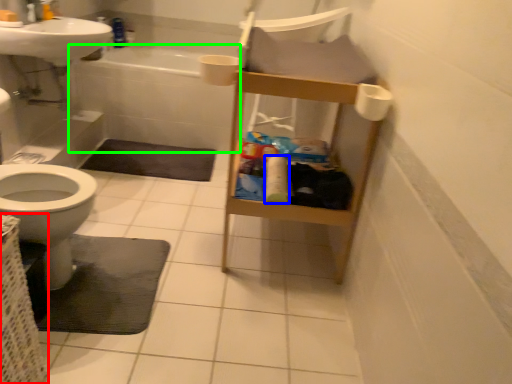
Question: Which object is the farthest from basket (highlighted by a red box)? Choose among these: toilet paper (highlighted by a blue box) or bath (highlighted by a green box).

Choices:
 (A) toilet paper
 (B) bath

Answer: (B)